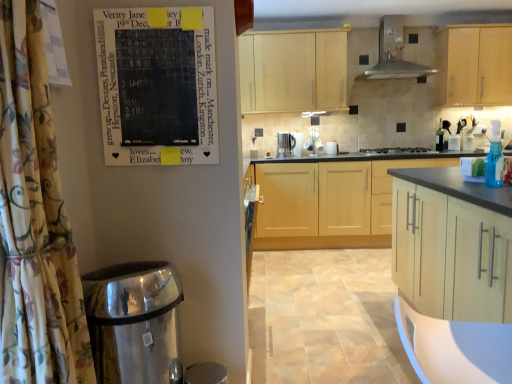
Question: Is light wood cabinet at upper center, which is counted as the first cabinetry, starting from the back, taller than satin silver coffee maker at center?

Choices:
 (A) yes
 (B) no

Answer: (A)

Question: Is light wood cabinet at upper center, the fourth cabinetry positioned from the front, bigger than satin silver coffee maker at center?

Choices:
 (A) yes
 (B) no

Answer: (A)

Question: Does light wood cabinet at upper center, the fourth cabinetry positioned from the front, have a greater width compared to satin silver coffee maker at center?

Choices:
 (A) no
 (B) yes

Answer: (B)

Question: Is satin silver coffee maker at center a part of light wood cabinet at upper center, which is counted as the first cabinetry, starting from the back?

Choices:
 (A) no
 (B) yes

Answer: (A)

Question: From a real-world perspective, is light wood cabinet at upper center, which is counted as the first cabinetry, starting from the back, located beneath satin silver coffee maker at center?

Choices:
 (A) no
 (B) yes

Answer: (A)

Question: From the image's perspective, relative to light wood cabinet at center, positioned as the first cabinetry in front-to-back order, is light wood cabinet at upper center, the fourth cabinetry positioned from the front, above or below?

Choices:
 (A) below
 (B) above

Answer: (B)

Question: Would you say light wood cabinet at upper center, which is counted as the first cabinetry, starting from the back, is to the left or to the right of light wood cabinet at center, positioned as the fourth cabinetry in back-to-front order, in the picture?

Choices:
 (A) right
 (B) left

Answer: (B)

Question: From a real-world perspective, relative to light wood cabinet at center, positioned as the fourth cabinetry in back-to-front order, is light wood cabinet at upper center, which is counted as the first cabinetry, starting from the back, vertically above or below?

Choices:
 (A) below
 (B) above

Answer: (B)

Question: In terms of width, does light wood cabinet at upper center, which is counted as the first cabinetry, starting from the back, look wider or thinner when compared to light wood cabinet at center, positioned as the first cabinetry in front-to-back order?

Choices:
 (A) wide
 (B) thin

Answer: (B)

Question: Relative to light wood cabinet at upper center, which is counted as the first cabinetry, starting from the back, is metallic stainless steel range hood at upper center in front or behind?

Choices:
 (A) front
 (B) behind

Answer: (A)

Question: From their relative heights in the image, would you say metallic stainless steel range hood at upper center is taller or shorter than light wood cabinet at upper center, the fourth cabinetry positioned from the front?

Choices:
 (A) short
 (B) tall

Answer: (A)

Question: Based on their sizes in the image, would you say metallic stainless steel range hood at upper center is bigger or smaller than light wood cabinet at upper center, which is counted as the first cabinetry, starting from the back?

Choices:
 (A) big
 (B) small

Answer: (B)

Question: Is metallic stainless steel range hood at upper center wider or thinner than light wood cabinet at upper center, the fourth cabinetry positioned from the front?

Choices:
 (A) wide
 (B) thin

Answer: (A)

Question: Is polished stainless steel water heater at lower left wider or thinner than floral fabric shower curtain at left?

Choices:
 (A) thin
 (B) wide

Answer: (B)

Question: In terms of height, does polished stainless steel water heater at lower left look taller or shorter compared to floral fabric shower curtain at left?

Choices:
 (A) short
 (B) tall

Answer: (A)